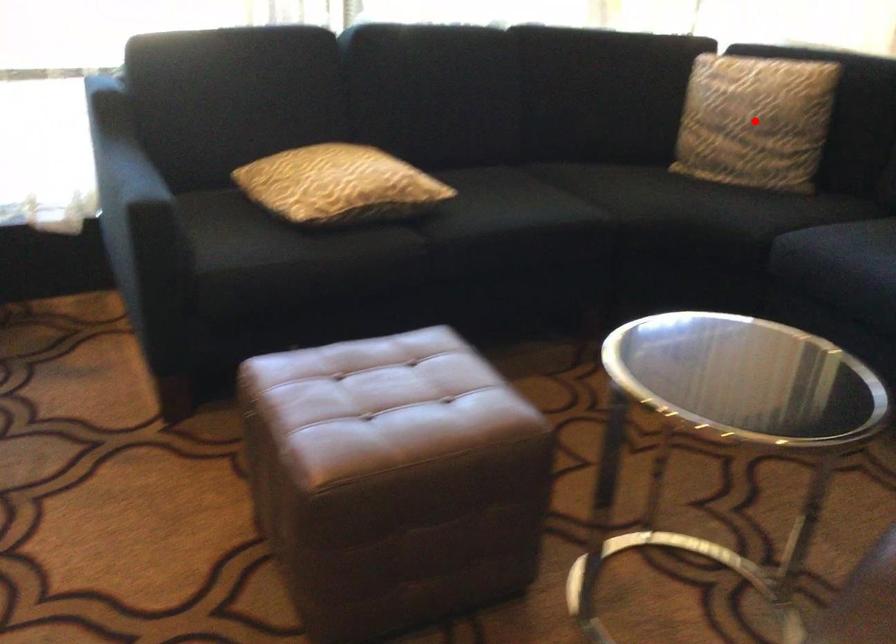
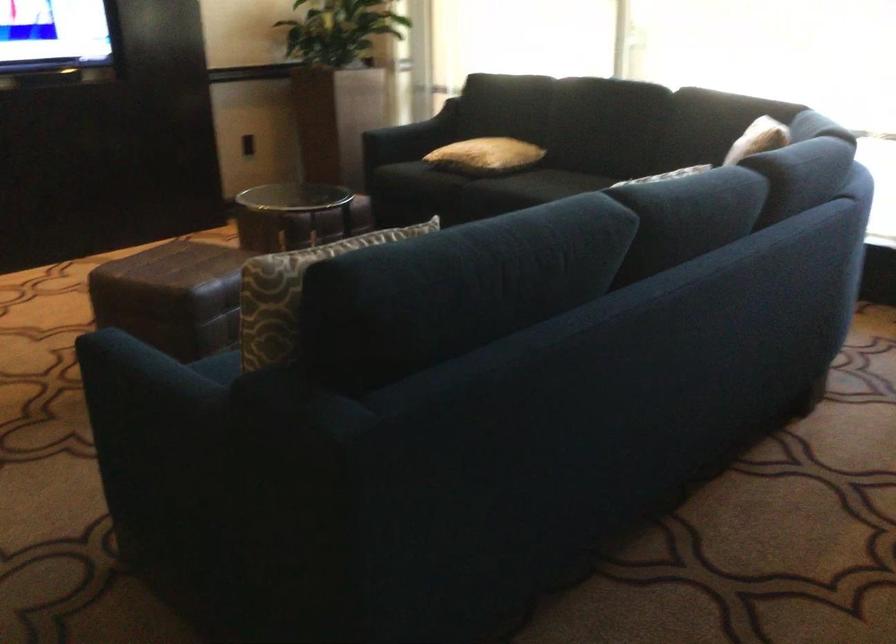
Question: I am providing you with two images of the same scene from different viewpoints. A red point is marked on the first image. Can you still see the location of the red point in image 2?

Choices:
 (A) Yes
 (B) No

Answer: (B)